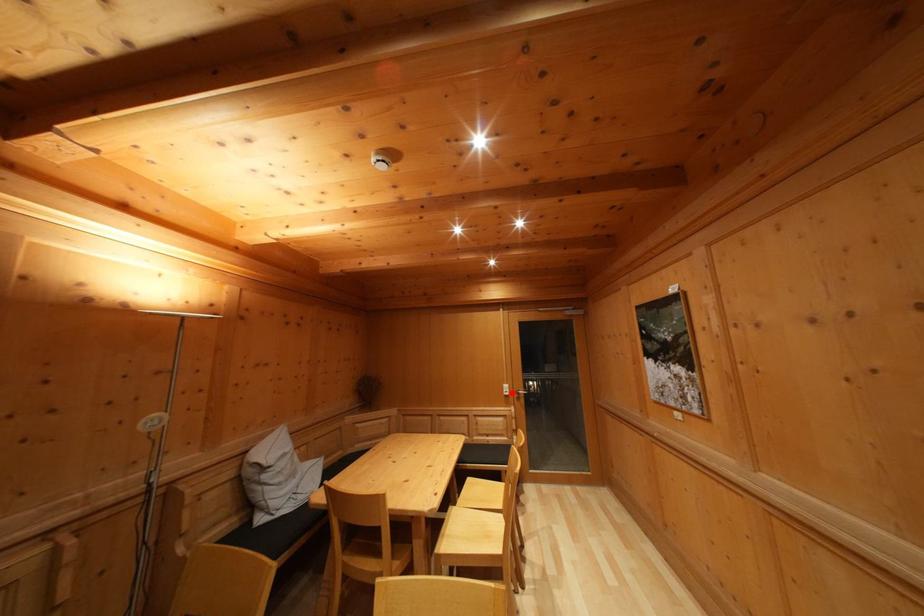
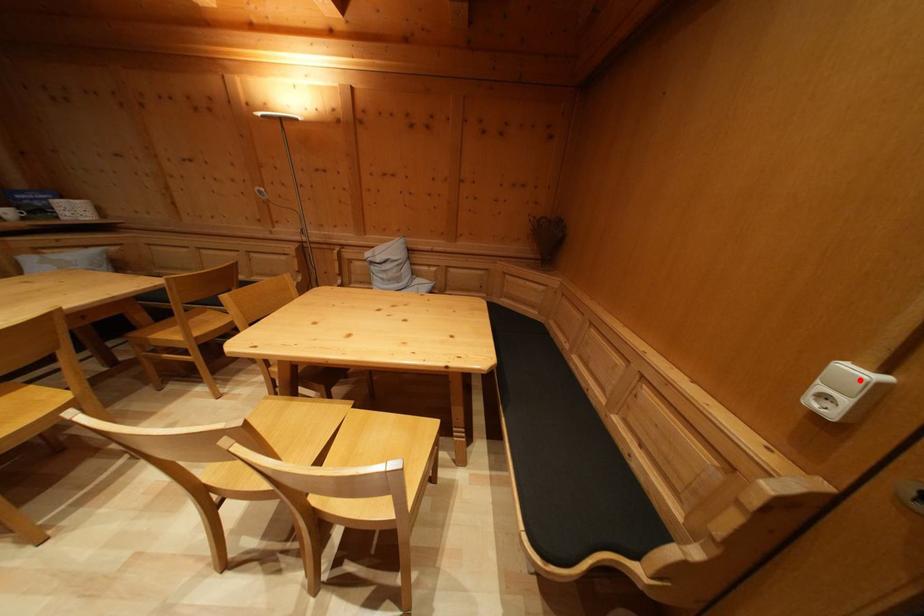
I am providing you with two images of the same scene from different viewpoints. A red point is marked on the first image and another point is marked on the second image. Do the highlighted points in image1 and image2 indicate the same real-world spot?

Yes